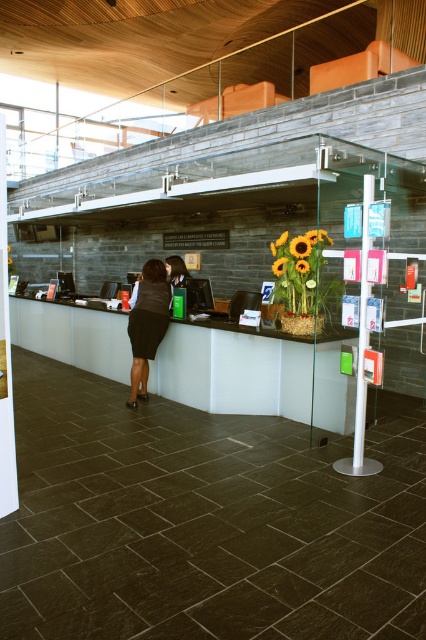
Question: Is white glossy information desk at center bigger than black fabric skirt at center?

Choices:
 (A) yes
 (B) no

Answer: (A)

Question: Among these points, which one is farthest from the camera?

Choices:
 (A) (60, 355)
 (B) (157, 278)

Answer: (A)

Question: Which point is closer to the camera?

Choices:
 (A) (48, 336)
 (B) (169, 291)

Answer: (B)

Question: Does white glossy information desk at center have a greater width compared to black fabric skirt at center?

Choices:
 (A) no
 (B) yes

Answer: (B)

Question: Which of the following is the farthest from the observer?

Choices:
 (A) black fabric skirt at center
 (B) white glossy information desk at center

Answer: (B)

Question: Is white glossy information desk at center positioned at the back of black fabric skirt at center?

Choices:
 (A) yes
 (B) no

Answer: (A)